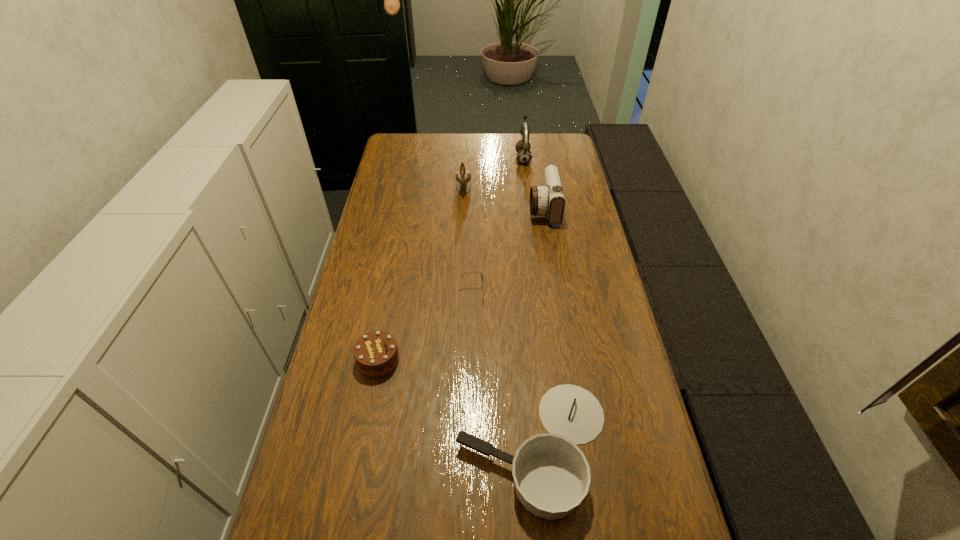
Identify the location of empty space that is in between the camcorder and the fourth farthest object. The width and height of the screenshot is (960, 540). (508, 251).

Locate an element on the screen. free spot between the camcorder and the chocolate cake is located at coordinates (461, 284).

Identify the location of free space between the camcorder and the sunglasses. (508, 251).

Find the location of a particular element. unoccupied position between the camcorder and the tallest object is located at coordinates tap(534, 184).

At what (x,y) coordinates should I click in order to perform the action: click on free area in between the third nearest object and the bird. Please return your answer as a coordinate pair (x, y). Looking at the image, I should click on (468, 239).

Where is `vacant point located between the chocolate cake and the tallest object`? The height and width of the screenshot is (540, 960). vacant point located between the chocolate cake and the tallest object is located at coordinates (450, 259).

The width and height of the screenshot is (960, 540). Identify the location of object that ranks as the second closest to the fifth farthest object. (470, 272).

Select which object appears as the third closest to the leftmost object. Please provide its 2D coordinates. Your answer should be formatted as a tuple, i.e. [(x, y)], where the tuple contains the x and y coordinates of a point satisfying the conditions above.

[(548, 199)]

Where is `free region that satisfies the following two spatial constraints: 1. on the surface of the camcorder; 2. on the front side of the nearest object`? free region that satisfies the following two spatial constraints: 1. on the surface of the camcorder; 2. on the front side of the nearest object is located at coordinates (583, 447).

Identify the location of vacant area that satisfies the following two spatial constraints: 1. in front of the lenses of the saucepan; 2. on the right side of the sunglasses. The width and height of the screenshot is (960, 540). (469, 447).